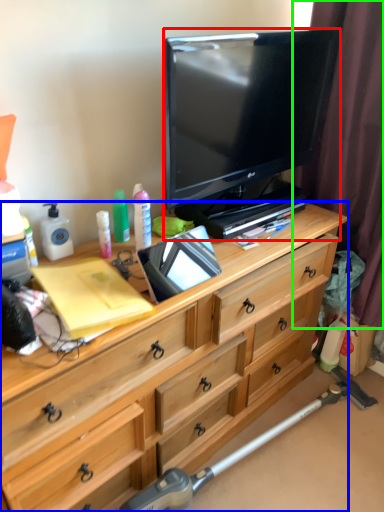
Question: Based on their relative distances, which object is nearer to television (highlighted by a red box)? Choose from desk (highlighted by a blue box) and curtain (highlighted by a green box).

Choices:
 (A) desk
 (B) curtain

Answer: (B)